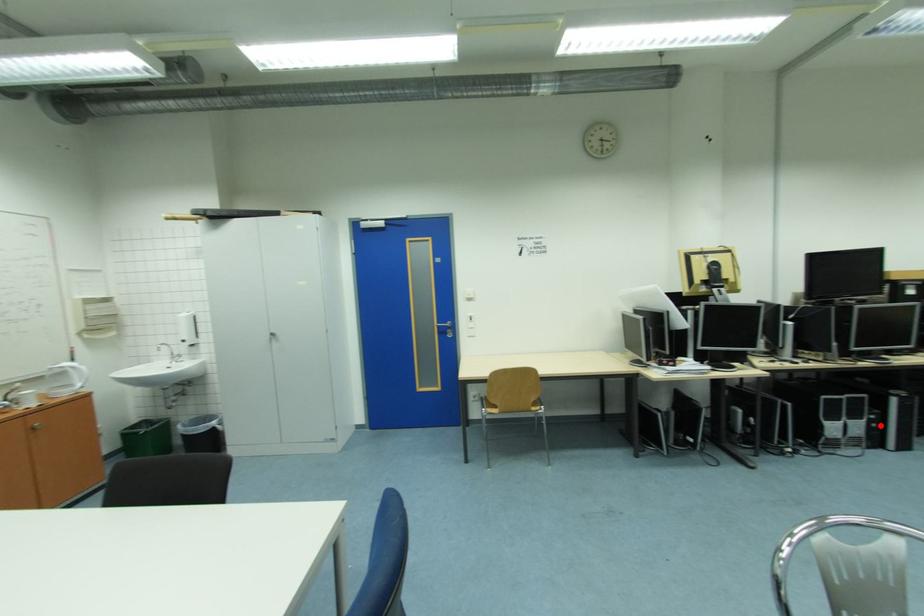
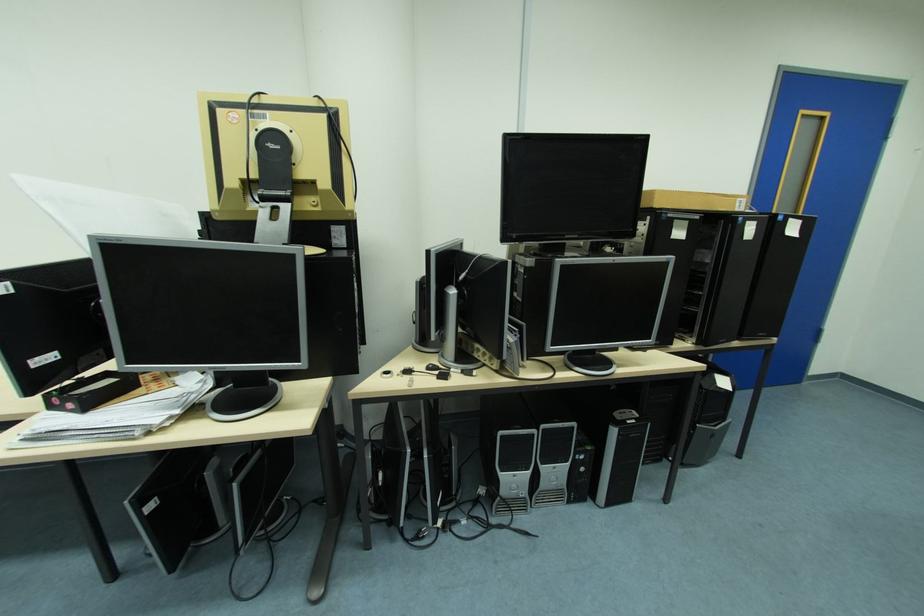
Question: I am providing you with two images of the same scene from different viewpoints. A red point is shown in image1. For the corresponding object point in image2, is it positioned nearer or farther from the camera?

Choices:
 (A) Nearer
 (B) Farther

Answer: (B)